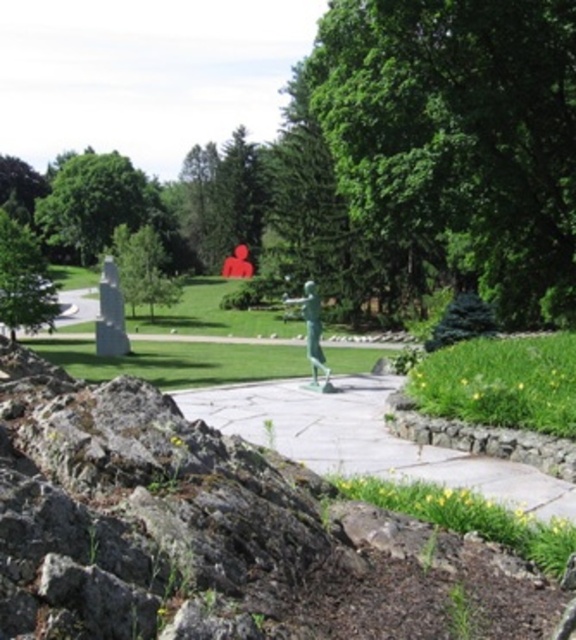
Based on the photo, you are planning to walk from the entrance of the park to the green sculpture in the center. The entrance is located near the green leafy tree at upper left. As you walk along the smooth stone path at center, will the path be shaded by the tree?

The smooth stone path at center is positioned under green leafy tree at upper left, so yes, the path will be shaded by the tree as you walk towards the green sculpture in the center.

You are standing at the entrance of the park and see the green leafy tree at center and the green leafy tree at left. Which tree is closer to you?

The green leafy tree at center is closer to you because it is in front of the green leafy tree at left.

You are a park visitor who wants to take a photo of both the green leafy tree at center and the green leafy tree at left in the same frame. Based on their heights, which tree should you stand closer to in order to include both in the photo?

Since the green leafy tree at center is taller than the green leafy tree at left, you should stand closer to the taller tree to ensure both are visible in the frame.